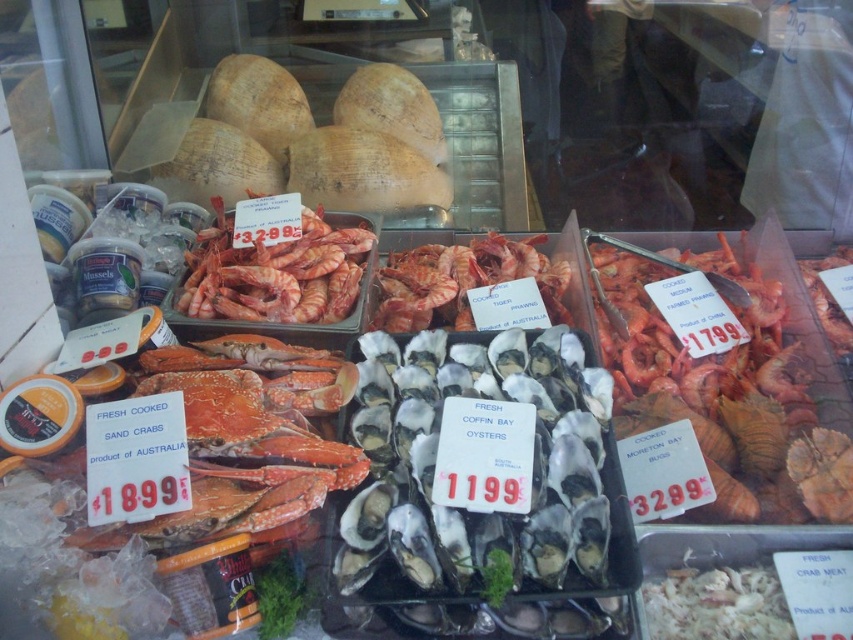
Which is behind, point (260, 316) or point (427, 294)?

The point (427, 294) is more distant.

Find the location of a particular element. shiny pink prawns at center is located at coordinates (276, 273).

Is white shell oysters at center below red matte tiger prawns at center?

Indeed, white shell oysters at center is positioned under red matte tiger prawns at center.

Between white shell oysters at center and red matte tiger prawns at center, which one appears on the right side from the viewer's perspective?

Positioned to the right is red matte tiger prawns at center.

Who is more forward, (337,584) or (403,296)?

Positioned in front is point (337,584).

You are a GUI agent. You are given a task and a screenshot of the screen. Output one action in this format:
    pyautogui.click(x=<x>, y=<y>)
    Task: Click on the white shell oysters at center
    This screenshot has width=853, height=640.
    Given the screenshot: What is the action you would take?
    pyautogui.click(x=486, y=513)

Who is lower down, white shell oysters at center or shiny pink prawns at center?

Positioned lower is white shell oysters at center.

Between point (392, 417) and point (326, 250), which one is positioned in front?

Positioned in front is point (392, 417).

You are a GUI agent. You are given a task and a screenshot of the screen. Output one action in this format:
    pyautogui.click(x=<x>, y=<y>)
    Task: Click on the white shell oysters at center
    
    Given the screenshot: What is the action you would take?
    pyautogui.click(x=486, y=513)